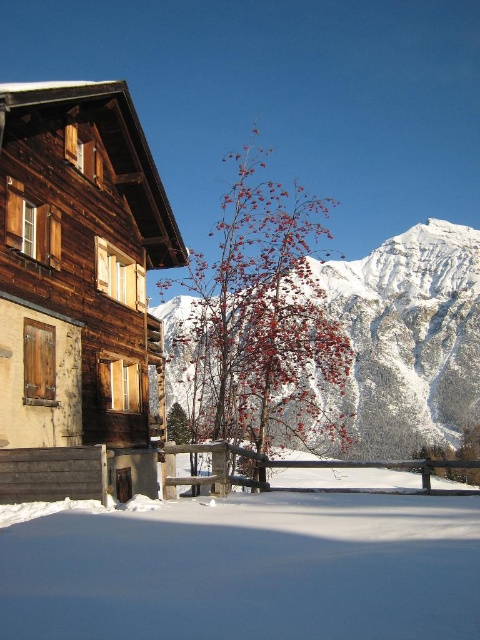
Can you confirm if white powdery snow at lower center is shorter than snowy white mountain at center?

Indeed, white powdery snow at lower center has a lesser height compared to snowy white mountain at center.

Does white powdery snow at lower center have a lesser width compared to snowy white mountain at center?

Indeed, white powdery snow at lower center has a lesser width compared to snowy white mountain at center.

Where is `white powdery snow at lower center`? The height and width of the screenshot is (640, 480). white powdery snow at lower center is located at coordinates (247, 570).

Can you confirm if wooden chalet at left is wider than white powdery snow at lower center?

No, wooden chalet at left is not wider than white powdery snow at lower center.

Does wooden chalet at left have a smaller size compared to white powdery snow at lower center?

No, wooden chalet at left is not smaller than white powdery snow at lower center.

Is point (135, 372) farther from camera compared to point (384, 497)?

No.

Locate an element on the screen. wooden chalet at left is located at coordinates (79, 292).

Can you confirm if wooden chalet at left is taller than snowy white mountain at center?

No.

I want to click on wooden chalet at left, so click(x=79, y=292).

Does point (159, 339) lie behind point (466, 378)?

That is False.

You are a GUI agent. You are given a task and a screenshot of the screen. Output one action in this format:
    pyautogui.click(x=<x>, y=<y>)
    Task: Click on the wooden chalet at left
    The width and height of the screenshot is (480, 640).
    Given the screenshot: What is the action you would take?
    pyautogui.click(x=79, y=292)